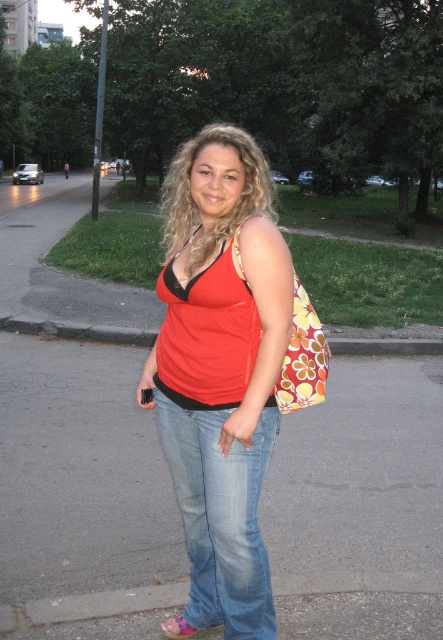
Does point (265, 595) come closer to viewer compared to point (311, 390)?

No.

Based on the photo, is light blue denim jeans at center smaller than floral fabric bag at right?

No, light blue denim jeans at center is not smaller than floral fabric bag at right.

Is point (201, 422) closer to camera compared to point (309, 364)?

Yes.

You are a GUI agent. You are given a task and a screenshot of the screen. Output one action in this format:
    pyautogui.click(x=<x>, y=<y>)
    Task: Click on the light blue denim jeans at center
    
    Given the screenshot: What is the action you would take?
    pyautogui.click(x=221, y=516)

Is the position of brushed concrete curb at lower center less distant than that of pink fabric sandal at lower center?

No, brushed concrete curb at lower center is further to the viewer.

Is point (100, 339) farther from viewer compared to point (186, 621)?

Yes, point (100, 339) is behind point (186, 621).

Who is more distant from viewer, (132, 342) or (166, 634)?

The point (132, 342) is behind.

Where is `brushed concrete curb at lower center`? Image resolution: width=443 pixels, height=640 pixels. brushed concrete curb at lower center is located at coordinates (78, 330).

Does gray asphalt pavement at center come in front of matte red vest at center?

No, it is not.

Between gray asphalt pavement at center and matte red vest at center, which one has less height?

With less height is matte red vest at center.

Who is more distant from viewer, (x=186, y=573) or (x=225, y=282)?

Positioned behind is point (x=186, y=573).

The image size is (443, 640). In order to click on gray asphalt pavement at center in this screenshot , I will do `click(77, 438)`.